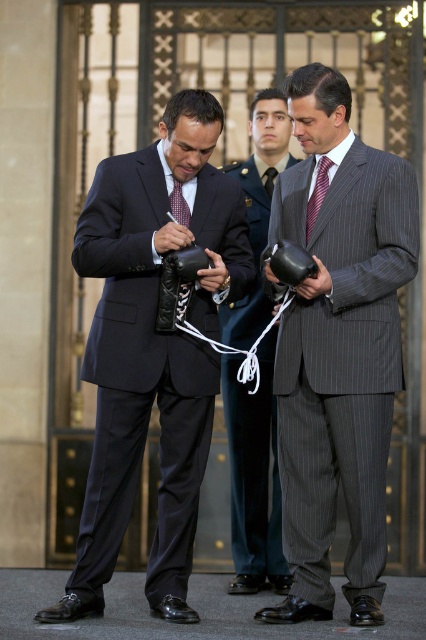
Question: Considering the real-world distances, which object is farthest from the gray pinstripe suit at center?

Choices:
 (A) pinstriped suit at center
 (B) striped silk tie at center

Answer: (A)

Question: Is gray pinstripe suit at center wider than pinstriped suit at center?

Choices:
 (A) yes
 (B) no

Answer: (A)

Question: Which point is closer to the camera?

Choices:
 (A) (314, 204)
 (B) (264, 179)
 (C) (334, 204)

Answer: (C)

Question: Can you confirm if gray pinstripe suit at center is positioned to the left of silky black tie at center?

Choices:
 (A) no
 (B) yes

Answer: (A)

Question: Which object is closer to the camera taking this photo?

Choices:
 (A) striped silk tie at center
 (B) silky black tie at center

Answer: (A)

Question: Where is gray pinstripe suit at center located in relation to pinstriped suit at center in the image?

Choices:
 (A) right
 (B) left

Answer: (A)